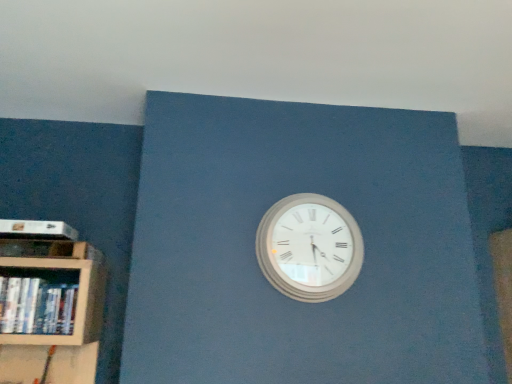
Question: Does white matte paperback book at left appear on the right side of white wooden wall clock at center?

Choices:
 (A) no
 (B) yes

Answer: (A)

Question: Is white matte paperback book at left wider than white wooden wall clock at center?

Choices:
 (A) no
 (B) yes

Answer: (B)

Question: Is white matte paperback book at left positioned with its back to white wooden wall clock at center?

Choices:
 (A) yes
 (B) no

Answer: (B)

Question: Is white matte paperback book at left thinner than white wooden wall clock at center?

Choices:
 (A) yes
 (B) no

Answer: (B)

Question: Can you confirm if white matte paperback book at left is shorter than white wooden wall clock at center?

Choices:
 (A) yes
 (B) no

Answer: (A)

Question: Is white matte paperback book at left smaller than white wooden wall clock at center?

Choices:
 (A) yes
 (B) no

Answer: (A)

Question: From the image's perspective, is white wooden wall clock at center on white matte paperback book at left?

Choices:
 (A) no
 (B) yes

Answer: (A)

Question: Is the surface of white wooden wall clock at center in direct contact with white matte paperback book at left?

Choices:
 (A) no
 (B) yes

Answer: (A)

Question: From the image's perspective, is white wooden wall clock at center under white matte paperback book at left?

Choices:
 (A) no
 (B) yes

Answer: (B)

Question: Is white wooden wall clock at center not inside white matte paperback book at left?

Choices:
 (A) no
 (B) yes

Answer: (B)

Question: Is white wooden wall clock at center far away from white matte paperback book at left?

Choices:
 (A) no
 (B) yes

Answer: (A)

Question: From a real-world perspective, does white wooden wall clock at center sit lower than white matte paperback book at left?

Choices:
 (A) no
 (B) yes

Answer: (B)

Question: Is white matte paperback book at left outside of white glossy book at left?

Choices:
 (A) yes
 (B) no

Answer: (A)